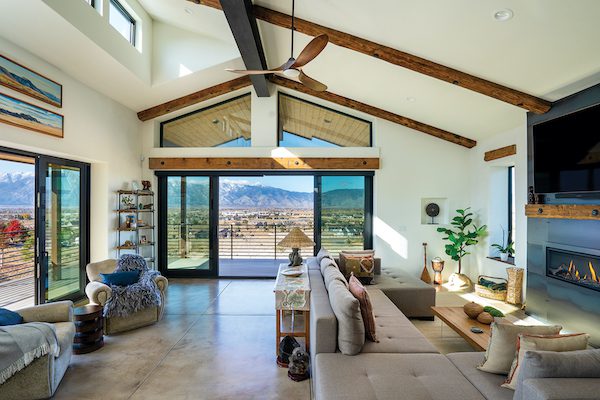
Where is `two rectagular pictures on the left wall`? The width and height of the screenshot is (600, 400). two rectagular pictures on the left wall is located at coordinates (52, 97), (50, 119).